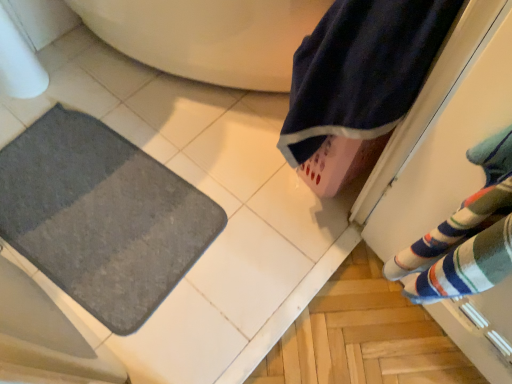
Question: Considering the positions of gray soft mat at lower left and navy blue towel at upper right in the image, is gray soft mat at lower left bigger or smaller than navy blue towel at upper right?

Choices:
 (A) big
 (B) small

Answer: (B)

Question: In terms of width, does gray soft mat at lower left look wider or thinner when compared to navy blue towel at upper right?

Choices:
 (A) wide
 (B) thin

Answer: (A)

Question: From the image's perspective, is gray soft mat at lower left above or below navy blue towel at upper right?

Choices:
 (A) below
 (B) above

Answer: (A)

Question: Is point (393, 52) closer or farther from the camera than point (91, 177)?

Choices:
 (A) closer
 (B) farther

Answer: (A)

Question: Considering their positions, is navy blue towel at upper right located in front of or behind gray soft mat at lower left?

Choices:
 (A) behind
 (B) front

Answer: (B)

Question: From the image's perspective, is navy blue towel at upper right positioned above or below gray soft mat at lower left?

Choices:
 (A) below
 (B) above

Answer: (B)

Question: In terms of height, does navy blue towel at upper right look taller or shorter compared to gray soft mat at lower left?

Choices:
 (A) short
 (B) tall

Answer: (B)